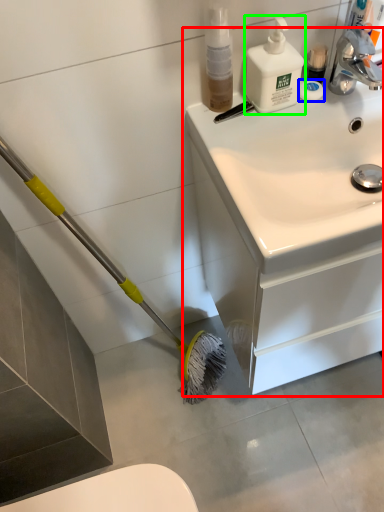
Question: Which is nearer to the bathroom cabinet (highlighted by a red box)? soap (highlighted by a blue box) or cleaning product (highlighted by a green box).

Choices:
 (A) soap
 (B) cleaning product

Answer: (B)